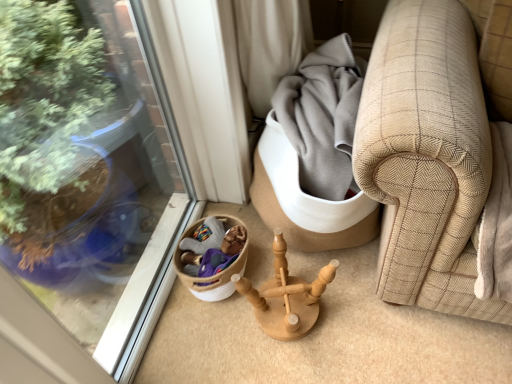
Image resolution: width=512 pixels, height=384 pixels. Find the location of `natural wood candlestick holder at center`. natural wood candlestick holder at center is located at coordinates (286, 296).

What do you see at coordinates (286, 296) in the screenshot? I see `natural wood candlestick holder at center` at bounding box center [286, 296].

The width and height of the screenshot is (512, 384). Describe the element at coordinates (211, 277) in the screenshot. I see `woven beige basket at lower left` at that location.

Consider the image. What is the approximate height of woven beige basket at lower left?

woven beige basket at lower left is 6.63 inches in height.

Image resolution: width=512 pixels, height=384 pixels. What are the coordinates of `woven beige basket at lower left` in the screenshot? It's located at (211, 277).

Where is `natural wood candlestick holder at center`? Image resolution: width=512 pixels, height=384 pixels. natural wood candlestick holder at center is located at coordinates (286, 296).

Does natural wood candlestick holder at center appear on the right side of woven beige basket at lower left?

Yes.

In the scene shown: Which object is more forward, natural wood candlestick holder at center or woven beige basket at lower left?

natural wood candlestick holder at center is more forward.

Which is in front, point (287, 273) or point (207, 299)?

The point (287, 273) is closer.

From the picture: From the image's perspective, which object appears higher, natural wood candlestick holder at center or woven beige basket at lower left?

From the image's view, woven beige basket at lower left is above.

From a real-world perspective, is natural wood candlestick holder at center under woven beige basket at lower left?

No, from a real-world perspective, natural wood candlestick holder at center is not below woven beige basket at lower left.

Which of these two, natural wood candlestick holder at center or woven beige basket at lower left, is thinner?

Thinner between the two is woven beige basket at lower left.

Can you confirm if natural wood candlestick holder at center is shorter than woven beige basket at lower left?

Incorrect, the height of natural wood candlestick holder at center does not fall short of that of woven beige basket at lower left.

Which of these two, natural wood candlestick holder at center or woven beige basket at lower left, is bigger?

natural wood candlestick holder at center.

Is natural wood candlestick holder at center outside of woven beige basket at lower left?

Absolutely, natural wood candlestick holder at center is external to woven beige basket at lower left.

Can you see natural wood candlestick holder at center touching woven beige basket at lower left?

No, natural wood candlestick holder at center is not touching woven beige basket at lower left.

Is natural wood candlestick holder at center oriented towards woven beige basket at lower left?

No, natural wood candlestick holder at center is not facing towards woven beige basket at lower left.

Measure the distance from natural wood candlestick holder at center to woven beige basket at lower left.

natural wood candlestick holder at center is 5.96 inches from woven beige basket at lower left.

Find the location of a particular element. Image resolution: width=512 pixels, height=384 pixels. miniature that is above the woven beige basket at lower left (from a real-world perspective) is located at coordinates (286, 296).

Is woven beige basket at lower left at the left side of natural wood candlestick holder at center?

Correct, you'll find woven beige basket at lower left to the left of natural wood candlestick holder at center.

Relative to natural wood candlestick holder at center, is woven beige basket at lower left in front or behind?

woven beige basket at lower left is behind natural wood candlestick holder at center.

Between point (230, 291) and point (234, 281), which one is positioned behind?

The point (230, 291) is more distant.

From the image's perspective, does woven beige basket at lower left appear higher than natural wood candlestick holder at center?

Yes, from the image's perspective, woven beige basket at lower left is over natural wood candlestick holder at center.

From a real-world perspective, who is located lower, woven beige basket at lower left or natural wood candlestick holder at center?

woven beige basket at lower left, from a real-world perspective.

Does woven beige basket at lower left have a lesser width compared to natural wood candlestick holder at center?

Yes, woven beige basket at lower left is thinner than natural wood candlestick holder at center.

Consider the image. Considering the sizes of objects woven beige basket at lower left and natural wood candlestick holder at center in the image provided, who is shorter, woven beige basket at lower left or natural wood candlestick holder at center?

Standing shorter between the two is woven beige basket at lower left.

In the scene shown: Considering the sizes of objects woven beige basket at lower left and natural wood candlestick holder at center in the image provided, who is bigger, woven beige basket at lower left or natural wood candlestick holder at center?

natural wood candlestick holder at center is bigger.

Is woven beige basket at lower left spatially inside natural wood candlestick holder at center, or outside of it?

woven beige basket at lower left is located beyond the bounds of natural wood candlestick holder at center.

Is the surface of woven beige basket at lower left in direct contact with natural wood candlestick holder at center?

There is a gap between woven beige basket at lower left and natural wood candlestick holder at center.

Could you tell me if woven beige basket at lower left is facing natural wood candlestick holder at center?

Yes, woven beige basket at lower left is oriented towards natural wood candlestick holder at center.

How many degrees apart are the facing directions of woven beige basket at lower left and natural wood candlestick holder at center?

There is a 0.000386-degree angle between the facing directions of woven beige basket at lower left and natural wood candlestick holder at center.

The height and width of the screenshot is (384, 512). Identify the location of miniature to the right of woven beige basket at lower left. (286, 296).

This screenshot has height=384, width=512. I want to click on miniature located in front of the woven beige basket at lower left, so click(x=286, y=296).

Find the location of a particular element. This screenshot has width=512, height=384. miniature on the right of the woven beige basket at lower left is located at coordinates 286,296.